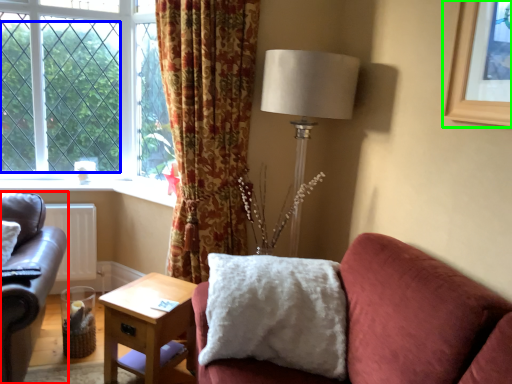
Question: Which object is the closest to the studio couch (highlighted by a red box)? Choose among these: tree (highlighted by a blue box) or picture frame (highlighted by a green box).

Choices:
 (A) tree
 (B) picture frame

Answer: (A)